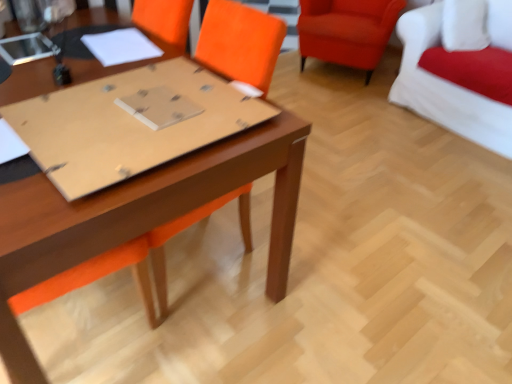
The image size is (512, 384). In order to click on free space above matte brown table at center (from a real-world perspective) in this screenshot , I will do `click(87, 105)`.